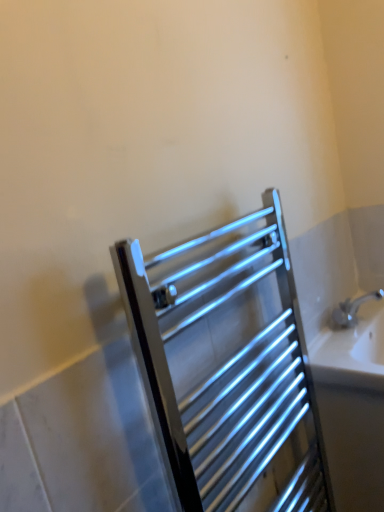
Question: Is white glossy sink at lower right bigger or smaller than chrome metallic towel rack at center?

Choices:
 (A) big
 (B) small

Answer: (A)

Question: Would you say white glossy sink at lower right is inside or outside chrome metallic towel rack at center?

Choices:
 (A) inside
 (B) outside

Answer: (B)

Question: From their relative heights in the image, would you say white glossy sink at lower right is taller or shorter than chrome metallic towel rack at center?

Choices:
 (A) tall
 (B) short

Answer: (B)

Question: In terms of height, does chrome metallic towel rack at center look taller or shorter compared to white glossy sink at lower right?

Choices:
 (A) short
 (B) tall

Answer: (B)

Question: In terms of size, does chrome metallic towel rack at center appear bigger or smaller than white glossy sink at lower right?

Choices:
 (A) small
 (B) big

Answer: (A)

Question: From the image's perspective, is chrome metallic towel rack at center above or below white glossy sink at lower right?

Choices:
 (A) above
 (B) below

Answer: (A)

Question: Do you think chrome metallic towel rack at center is within white glossy sink at lower right, or outside of it?

Choices:
 (A) outside
 (B) inside

Answer: (A)